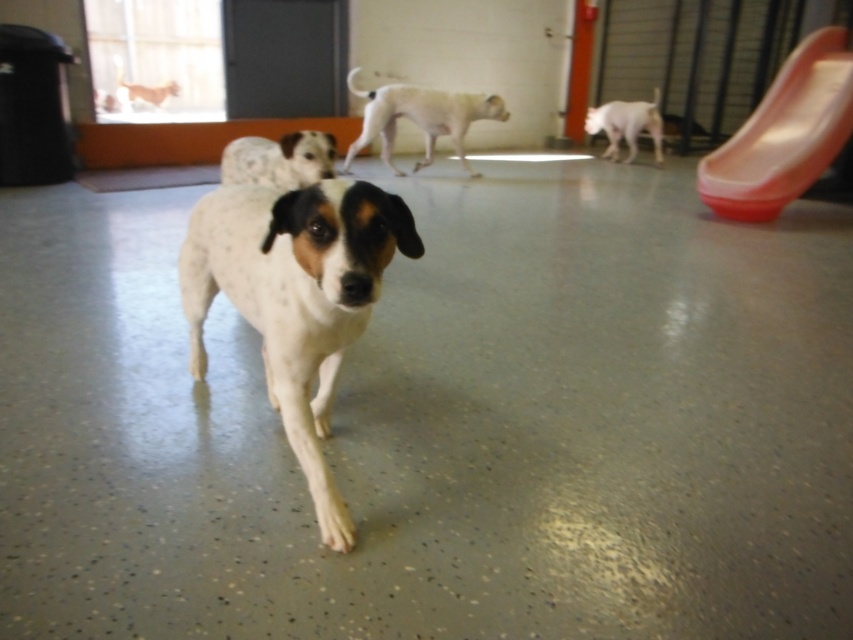
You are a dog owner whose pet is currently at the white smooth dog at center. You want to take your dog to the rubberized orange slide at upper right. Is the slide visible to your dog from its current position?

The rubberized orange slide at upper right is in front of the white smooth dog at center, so yes, the slide is visible to the dog from its current position.

You are standing in the dog play area and see the white smooth dog at center and the speckled fur dog at center. Which dog is positioned more to the right side of the scene?

The white smooth dog at center is positioned to the right of the speckled fur dog at center, so the white smooth dog at center is more to the right side of the scene.